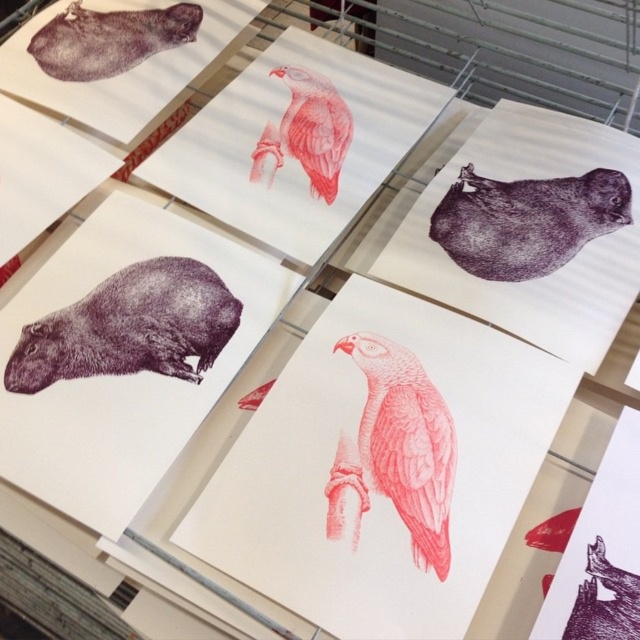
Question: Which point appears farthest from the camera in this image?

Choices:
 (A) (632, 625)
 (B) (508, 234)
 (C) (326, 116)

Answer: (C)

Question: Observing the image, what is the correct spatial positioning of purple dotted capybara at lower left in reference to red textured bird at center?

Choices:
 (A) right
 (B) left

Answer: (B)

Question: Which object is the closest to the purple textured capybara at upper right?

Choices:
 (A) purple ink capybara at upper right
 (B) pink paper parrot at center
 (C) purple dotted capybara at lower left

Answer: (B)

Question: Which object appears closest to the camera in this image?

Choices:
 (A) purple dotted capybara at lower left
 (B) purple matte capybara at upper left
 (C) purple textured capybara at upper right

Answer: (C)

Question: Can you confirm if purple ink capybara at upper right is bigger than purple textured capybara at upper right?

Choices:
 (A) no
 (B) yes

Answer: (B)

Question: Is purple ink capybara at upper right smaller than purple matte capybara at upper left?

Choices:
 (A) yes
 (B) no

Answer: (B)